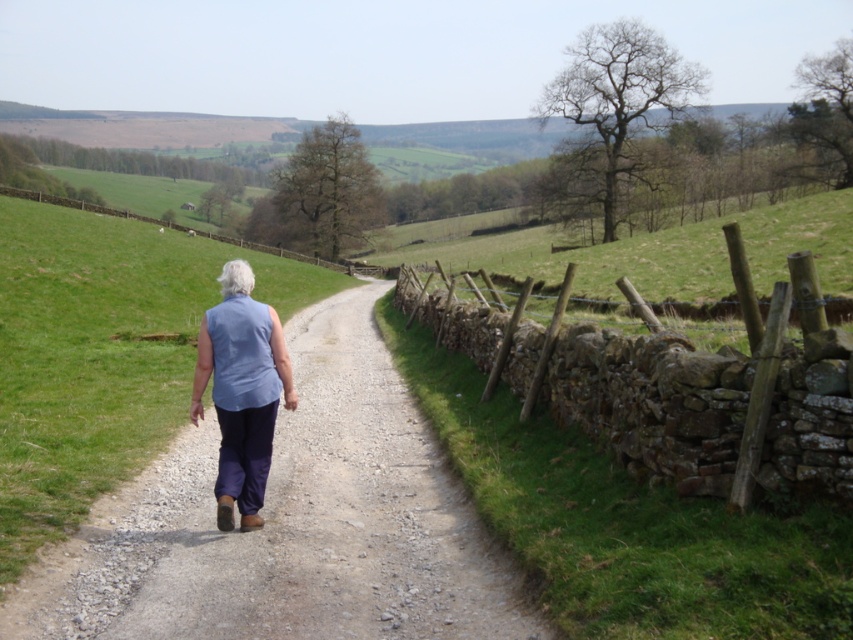
You are standing at the starting point of the path and want to walk towards the fence. Which direction should you turn to face the brown stone fence at right from the dusty gravel path at center?

To face the brown stone fence at right from the dusty gravel path at center, you should turn to your right since the fence is located to the right of the path.

In the scene shown: You are standing at the starting point of the dirt path and want to walk towards the brown stone fence at right. Which direction should you move relative to the path?

The brown stone fence at right is located at point (x=663, y=394), so you should move towards the right side of the path to reach it.

You are a hiker trying to follow the path. The dusty gravel path at center is your current route. There is a brown stone fence at right nearby. Which one is taller?

The brown stone fence at right is taller than the dusty gravel path at center.